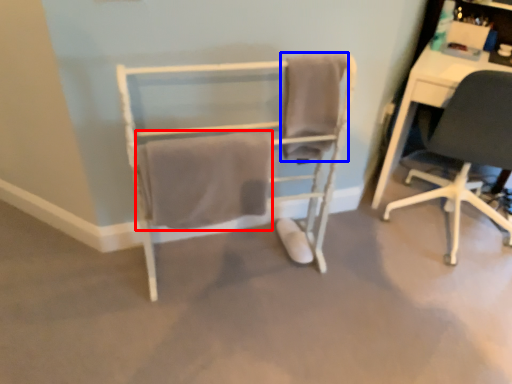
Question: Which object is closer to the camera taking this photo, bath towel (highlighted by a red box) or bath towel (highlighted by a blue box)?

Choices:
 (A) bath towel
 (B) bath towel

Answer: (A)